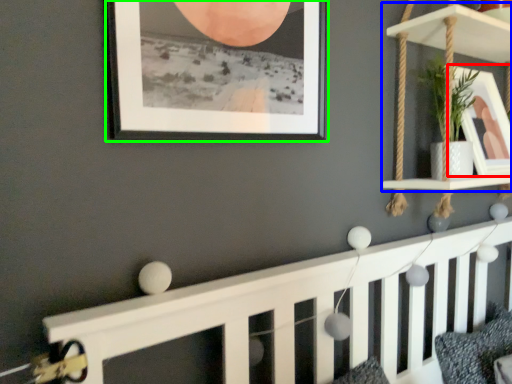
Question: Based on their relative distances, which object is farther from picture frame (highlighted by a red box)? Choose from shelf (highlighted by a blue box) and picture frame (highlighted by a green box).

Choices:
 (A) shelf
 (B) picture frame

Answer: (B)